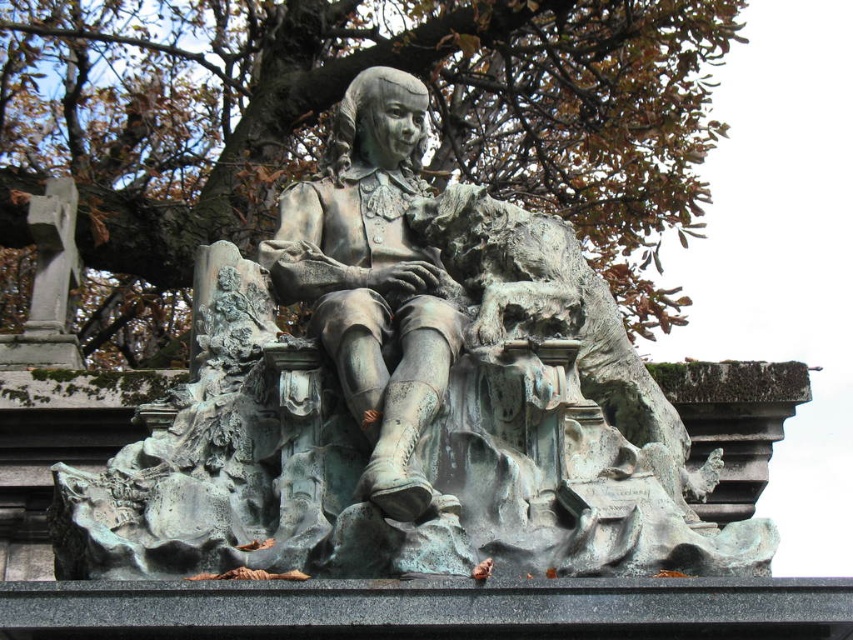
Question: Which point is closer to the camera?

Choices:
 (A) (665, 524)
 (B) (654, 262)
 (C) (393, 97)

Answer: (A)

Question: Which object is positioned closest to the green patina statue at center?

Choices:
 (A) bronze statue at center
 (B) brown textured tree at upper center

Answer: (A)

Question: Is green patina statue at center positioned before bronze statue at center?

Choices:
 (A) yes
 (B) no

Answer: (A)

Question: Is brown textured tree at upper center positioned before bronze statue at center?

Choices:
 (A) yes
 (B) no

Answer: (B)

Question: Estimate the real-world distances between objects in this image. Which object is closer to the brown textured tree at upper center?

Choices:
 (A) bronze statue at center
 (B) green patina statue at center

Answer: (B)

Question: Is green patina statue at center above brown textured tree at upper center?

Choices:
 (A) no
 (B) yes

Answer: (A)